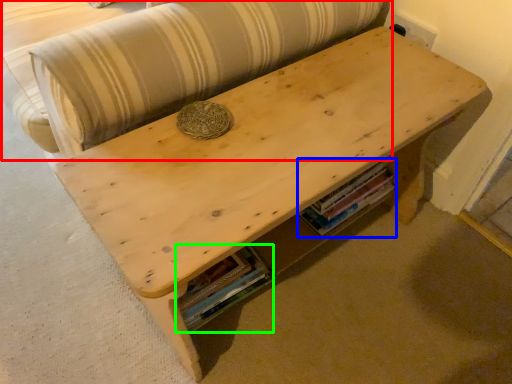
Question: Which object is positioned closest to couch (highlighted by a red box)? Select from book (highlighted by a blue box) and book (highlighted by a green box).

Choices:
 (A) book
 (B) book

Answer: (B)